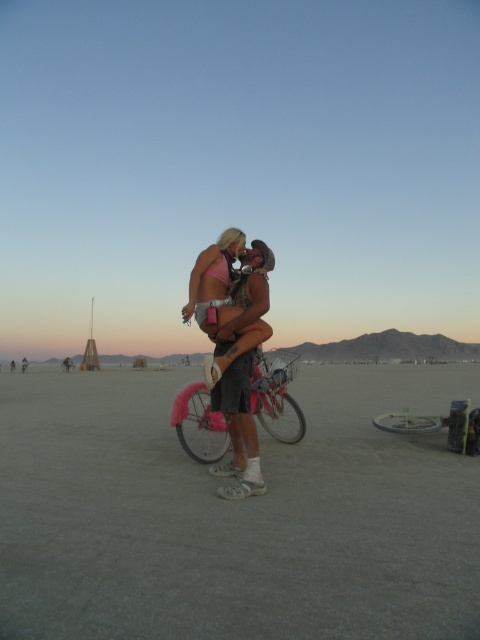
Question: Does pink fabric bikini top at center lie in front of pink fluffy bicycle at center?

Choices:
 (A) yes
 (B) no

Answer: (A)

Question: Is pink fabric bikini top at center below pink fluffy bicycle at center?

Choices:
 (A) yes
 (B) no

Answer: (B)

Question: Which object is closer to the camera taking this photo?

Choices:
 (A) pink fluffy bicycle at center
 (B) pink fabric bikini top at center

Answer: (B)

Question: Is pink fabric bikini top at center positioned at the back of pink fluffy bicycle at center?

Choices:
 (A) no
 (B) yes

Answer: (A)